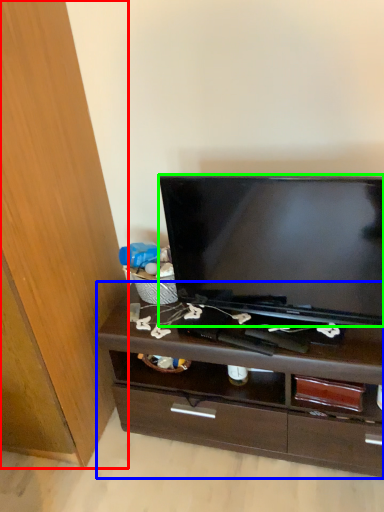
Question: Which object is positioned closest to cabinetry (highlighted by a red box)? Select from chest of drawers (highlighted by a blue box) and television (highlighted by a green box).

Choices:
 (A) chest of drawers
 (B) television

Answer: (A)